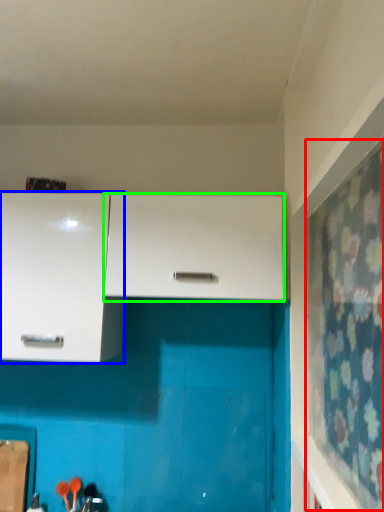
Question: Based on their relative distances, which object is nearer to curtain (highlighted by a red box)? Choose from cabinetry (highlighted by a blue box) and cabinetry (highlighted by a green box).

Choices:
 (A) cabinetry
 (B) cabinetry

Answer: (B)